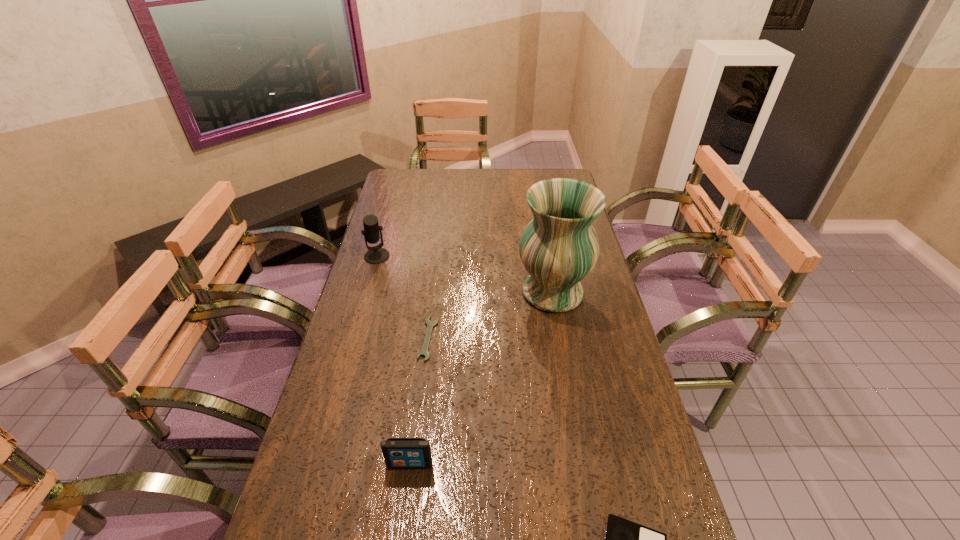
Find the location of a particular element. object positioned at the right edge is located at coordinates (559, 247).

This screenshot has width=960, height=540. What are the coordinates of `vacant region at the far edge of the desktop` in the screenshot? It's located at (516, 171).

Find the location of a particular element. vacant region at the left edge of the desktop is located at coordinates (347, 353).

At what (x,y) coordinates should I click in order to perform the action: click on free space at the right edge of the desktop. Please return your answer as a coordinate pair (x, y). The image size is (960, 540). Looking at the image, I should click on (585, 314).

Locate an element on the screen. The height and width of the screenshot is (540, 960). vacant area at the far left corner is located at coordinates (396, 171).

Find the location of a particular element. The image size is (960, 540). vacant space at the far right corner of the desktop is located at coordinates click(562, 172).

You are a GUI agent. You are given a task and a screenshot of the screen. Output one action in this format:
    pyautogui.click(x=<x>, y=<y>)
    Task: Click on the unoccupied area between the fourth shortest object and the left iPod
    The height and width of the screenshot is (540, 960).
    Given the screenshot: What is the action you would take?
    pyautogui.click(x=394, y=360)

The height and width of the screenshot is (540, 960). I want to click on empty space between the leftmost object and the left iPod, so click(x=394, y=360).

This screenshot has height=540, width=960. I want to click on free area in between the farthest object and the shortest object, so click(x=402, y=298).

Where is `empty space between the shortest object and the tallest object`? Image resolution: width=960 pixels, height=540 pixels. empty space between the shortest object and the tallest object is located at coordinates (491, 315).